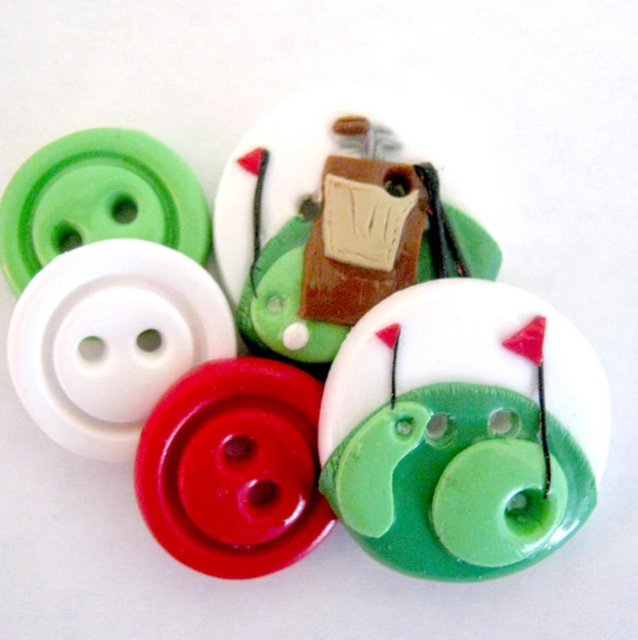
Based on the scene description, is the point at coordinate (323, 362) located on the green glossy button at upper center?

Yes, the point at coordinate (323, 362) is located on the green glossy button at upper center according to the objects description.

You are holding a camera and want to take a closeup photo of the green glossy button at center. The camera requires the subject to be at least 4 feet away to focus properly. Can you take the photo without moving the button?

The green glossy button at center is 4.11 feet away from camera, which is more than the minimum 4 feet requirement. Therefore, you can take the photo without moving the button.